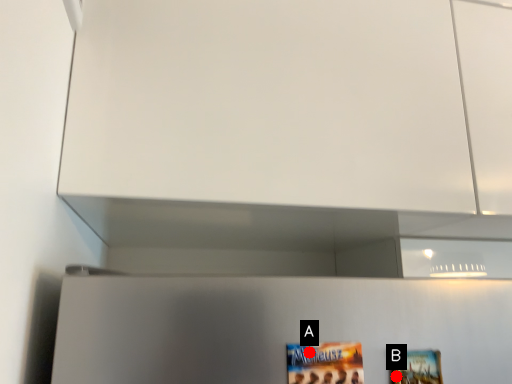
Question: Two points are circled on the image, labeled by A and B beside each circle. Which point is farther from the camera taking this photo?

Choices:
 (A) A is further
 (B) B is further

Answer: (B)